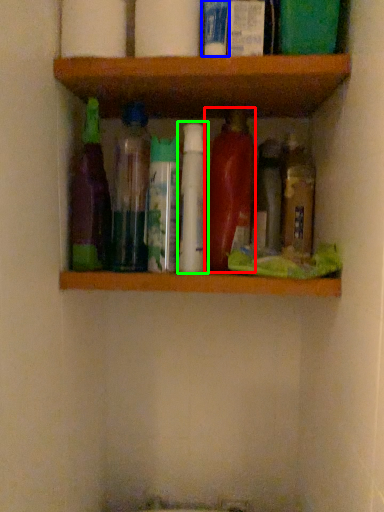
Question: Which object is the farthest from bottle (highlighted by a red box)? Choose among these: toiletry (highlighted by a blue box) or bottle (highlighted by a green box).

Choices:
 (A) toiletry
 (B) bottle

Answer: (A)